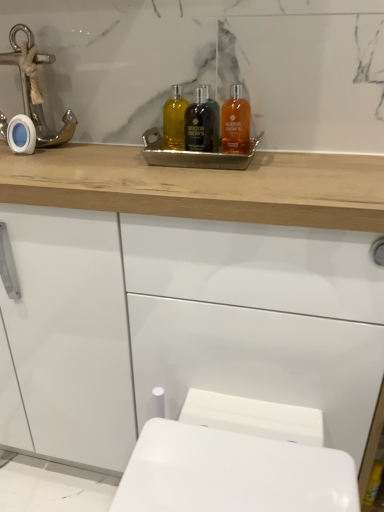
Where is `free space in front of translucent amber liquid at upper center, the third mouthwash viewed from the left`? The width and height of the screenshot is (384, 512). free space in front of translucent amber liquid at upper center, the third mouthwash viewed from the left is located at coordinates (250, 179).